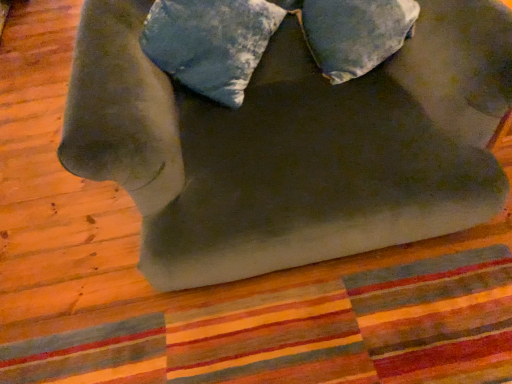
The width and height of the screenshot is (512, 384). Describe the element at coordinates (210, 43) in the screenshot. I see `velvety blue pillow at upper center` at that location.

Identify the location of velvety blue pillow at upper center. (210, 43).

Identify the location of velvety blue pillow at upper center. (210, 43).